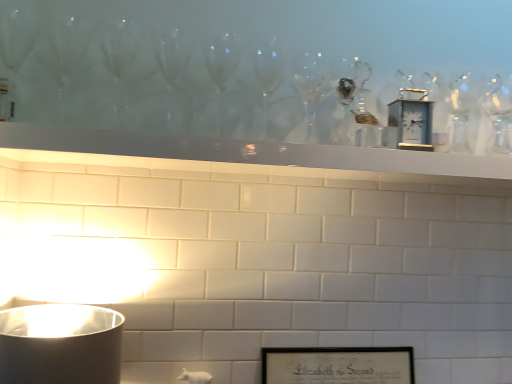
Where is `black matte picture frame at lower center`? This screenshot has width=512, height=384. black matte picture frame at lower center is located at coordinates (338, 365).

Where is `metallic silver clock at upper center`? This screenshot has height=384, width=512. metallic silver clock at upper center is located at coordinates (410, 122).

Locate an element on the screen. black matte picture frame at lower center is located at coordinates (338, 365).

Are black matte picture frame at lower center and metallic silver clock at upper center far apart?

No, black matte picture frame at lower center is not far from metallic silver clock at upper center.

Is black matte picture frame at lower center turned away from metallic silver clock at upper center?

No, black matte picture frame at lower center's orientation is not away from metallic silver clock at upper center.

Which object is more forward, black matte picture frame at lower center or metallic silver clock at upper center?

metallic silver clock at upper center.

Is black matte picture frame at lower center wider than metallic silver clock at upper center?

Indeed, black matte picture frame at lower center has a greater width compared to metallic silver clock at upper center.

Considering the positions of point (404, 121) and point (161, 152), is point (404, 121) closer or farther from the camera than point (161, 152)?

Clearly, point (404, 121) is more distant from the camera than point (161, 152).

Is metallic silver clock at upper center not near white glossy mantle at upper center?

No, metallic silver clock at upper center is in close proximity to white glossy mantle at upper center.

Which object is closer to the camera, metallic silver clock at upper center or white glossy mantle at upper center?

white glossy mantle at upper center.

From the image's perspective, is metallic silver clock at upper center beneath white glossy mantle at upper center?

No.

Would you say black matte picture frame at lower center is outside white glossy mantle at upper center?

Yes, black matte picture frame at lower center is not within white glossy mantle at upper center.

From the image's perspective, which is below, black matte picture frame at lower center or white glossy mantle at upper center?

black matte picture frame at lower center.

Are black matte picture frame at lower center and white glossy mantle at upper center making contact?

No, black matte picture frame at lower center is not touching white glossy mantle at upper center.

Between black matte picture frame at lower center and white glossy mantle at upper center, which one has more height?

Standing taller between the two is black matte picture frame at lower center.

The height and width of the screenshot is (384, 512). In order to click on picture frame below the white glossy mantle at upper center (from a real-world perspective) in this screenshot , I will do click(338, 365).

Does white glossy mantle at upper center appear on the left side of black matte picture frame at lower center?

Correct, you'll find white glossy mantle at upper center to the left of black matte picture frame at lower center.

Considering the positions of objects white glossy mantle at upper center and black matte picture frame at lower center in the image provided, who is in front, white glossy mantle at upper center or black matte picture frame at lower center?

Positioned in front is white glossy mantle at upper center.

Is point (294, 164) closer or farther from the camera than point (388, 353)?

Point (294, 164) is closer to the camera than point (388, 353).

Who is bigger, white glossy mantle at upper center or metallic silver clock at upper center?

With larger size is white glossy mantle at upper center.

Considering the sizes of objects white glossy mantle at upper center and metallic silver clock at upper center in the image provided, who is shorter, white glossy mantle at upper center or metallic silver clock at upper center?

With less height is white glossy mantle at upper center.

Could you tell me if white glossy mantle at upper center is turned towards metallic silver clock at upper center?

No, white glossy mantle at upper center does not turn towards metallic silver clock at upper center.

From the image's perspective, is metallic silver clock at upper center located above or below black matte picture frame at lower center?

From the image's perspective, metallic silver clock at upper center appears above black matte picture frame at lower center.

Is the position of metallic silver clock at upper center more distant than that of black matte picture frame at lower center?

No, metallic silver clock at upper center is in front of black matte picture frame at lower center.

Where is `picture frame behind the metallic silver clock at upper center`? Image resolution: width=512 pixels, height=384 pixels. picture frame behind the metallic silver clock at upper center is located at coordinates (338, 365).

Is metallic silver clock at upper center with black matte picture frame at lower center?

No.

Where is `picture frame below the metallic silver clock at upper center (from a real-world perspective)`? picture frame below the metallic silver clock at upper center (from a real-world perspective) is located at coordinates (338, 365).

Identify the location of clock that appears above the white glossy mantle at upper center (from the image's perspective). This screenshot has height=384, width=512. (410, 122).

Considering their positions, is metallic silver clock at upper center positioned further to white glossy mantle at upper center than black matte picture frame at lower center?

The object further to white glossy mantle at upper center is black matte picture frame at lower center.

Looking at the image, which one is located further to black matte picture frame at lower center, metallic silver clock at upper center or white glossy mantle at upper center?

metallic silver clock at upper center is positioned further to the anchor black matte picture frame at lower center.

Looking at the image, which one is located closer to metallic silver clock at upper center, black matte picture frame at lower center or white glossy mantle at upper center?

white glossy mantle at upper center is closer to metallic silver clock at upper center.

Which object lies nearer to the anchor point black matte picture frame at lower center, white glossy mantle at upper center or metallic silver clock at upper center?

white glossy mantle at upper center lies closer to black matte picture frame at lower center than the other object.

Looking at the image, which one is located further to metallic silver clock at upper center, white glossy mantle at upper center or black matte picture frame at lower center?

black matte picture frame at lower center.

Estimate the real-world distances between objects in this image. Which object is further from white glossy mantle at upper center, black matte picture frame at lower center or metallic silver clock at upper center?

black matte picture frame at lower center.

At what (x,y) coordinates should I click in order to perform the action: click on mantle between metallic silver clock at upper center and black matte picture frame at lower center in the vertical direction. Please return your answer as a coordinate pair (x, y). Looking at the image, I should click on (254, 152).